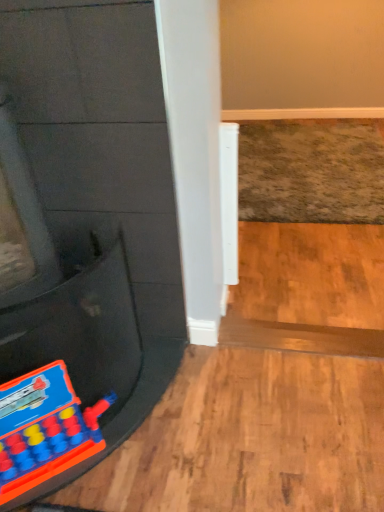
I want to click on free space below plastic toy train at lower left (from a real-world perspective), so click(x=75, y=464).